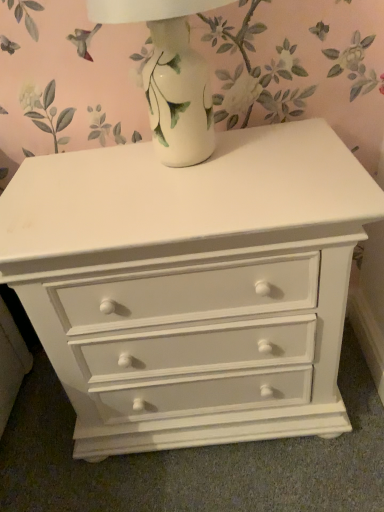
Question: Considering the positions of white glossy vase at upper center and white painted wood chest of drawers at center in the image, is white glossy vase at upper center taller or shorter than white painted wood chest of drawers at center?

Choices:
 (A) tall
 (B) short

Answer: (B)

Question: From the image's perspective, is white glossy vase at upper center above or below white painted wood chest of drawers at center?

Choices:
 (A) below
 (B) above

Answer: (B)

Question: Based on their positions, is white glossy vase at upper center located to the left or right of white painted wood chest of drawers at center?

Choices:
 (A) right
 (B) left

Answer: (B)

Question: In the image, is white painted wood chest of drawers at center on the left side or the right side of white glossy vase at upper center?

Choices:
 (A) right
 (B) left

Answer: (A)

Question: From a real-world perspective, is white painted wood chest of drawers at center physically located above or below white glossy vase at upper center?

Choices:
 (A) below
 (B) above

Answer: (A)

Question: Is white painted wood chest of drawers at center wider or thinner than white glossy vase at upper center?

Choices:
 (A) wide
 (B) thin

Answer: (A)

Question: Do you think white painted wood chest of drawers at center is within white glossy vase at upper center, or outside of it?

Choices:
 (A) outside
 (B) inside

Answer: (A)